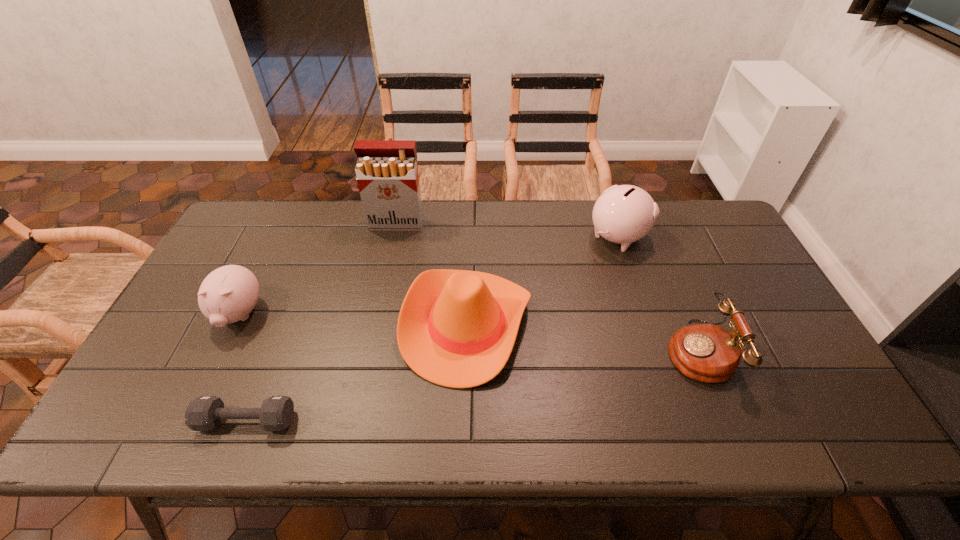
Identify the location of object that is the fifth nearest to the telephone. (228, 294).

Find the location of `object that is the fifth closest to the tallest object`. object that is the fifth closest to the tallest object is located at coordinates (708, 353).

Locate an element on the screen. vacant region that satisfies the following two spatial constraints: 1. with the lid open on the cowboy hat; 2. on the left side of the tallest object is located at coordinates (375, 324).

At what (x,y) coordinates should I click in order to perform the action: click on blank area in the image that satisfies the following two spatial constraints: 1. on the back side of the right piggy bank; 2. on the left side of the dumbbell. Please return your answer as a coordinate pair (x, y). This screenshot has width=960, height=540. Looking at the image, I should click on (318, 237).

Image resolution: width=960 pixels, height=540 pixels. I want to click on vacant space that satisfies the following two spatial constraints: 1. on the back side of the shortest object; 2. on the left side of the cowboy hat, so click(284, 324).